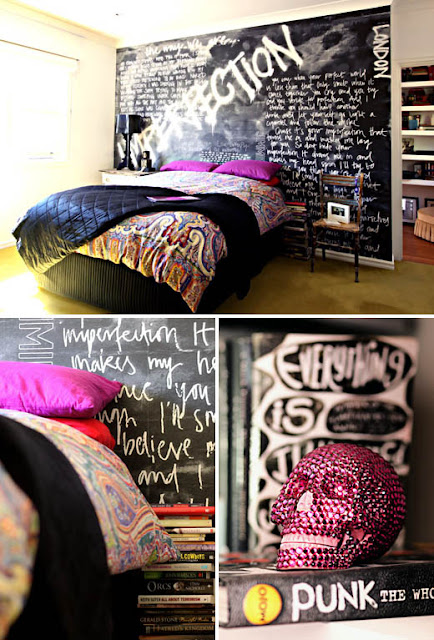
This screenshot has width=434, height=640. In order to click on peach colored footstool in this screenshot , I will do `click(429, 218)`.